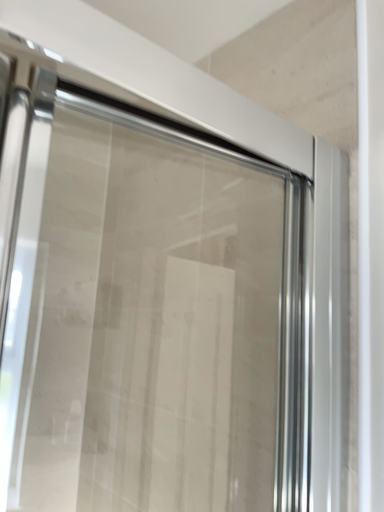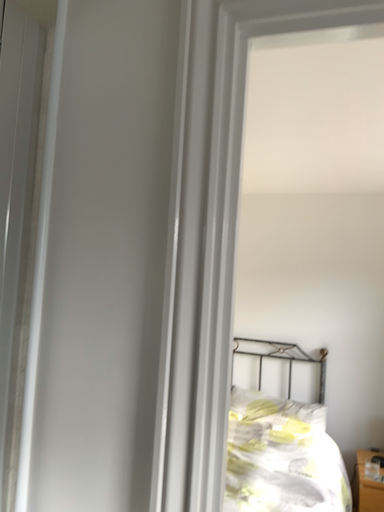
Question: Which way did the camera rotate in the video?

Choices:
 (A) rotated upward
 (B) rotated downward

Answer: (B)